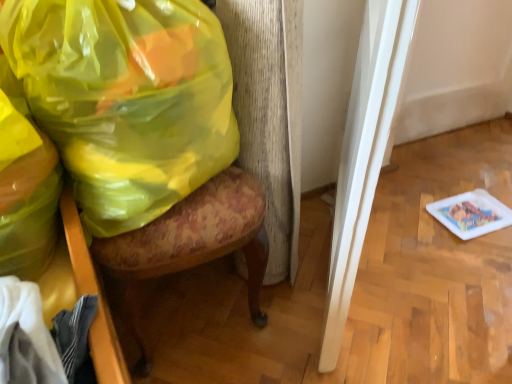
What do you see at coordinates (126, 99) in the screenshot? I see `translucent yellow plastic bag at left` at bounding box center [126, 99].

At what (x,y) coordinates should I click in order to perform the action: click on translucent yellow plastic bag at left. Please return your answer as a coordinate pair (x, y). Looking at the image, I should click on (126, 99).

In order to face translucent yellow plastic bag at left, should I rotate leftwards or rightwards?

To face it directly, rotate left by 15.511 degrees.

What are the coordinates of `translucent yellow plastic bag at left` in the screenshot? It's located at (126, 99).